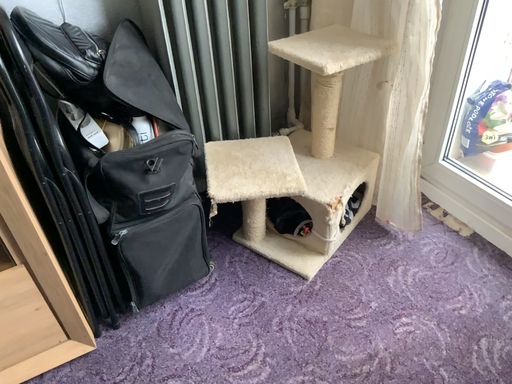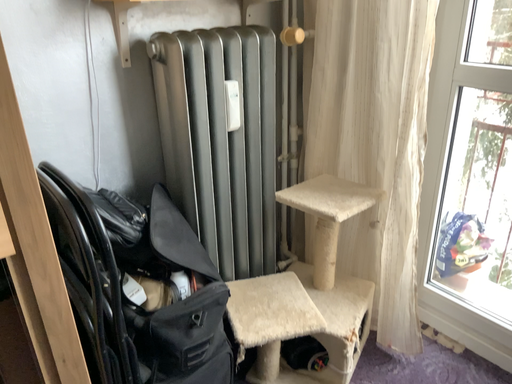
Question: Which way did the camera rotate in the video?

Choices:
 (A) rotated downward
 (B) rotated upward

Answer: (B)